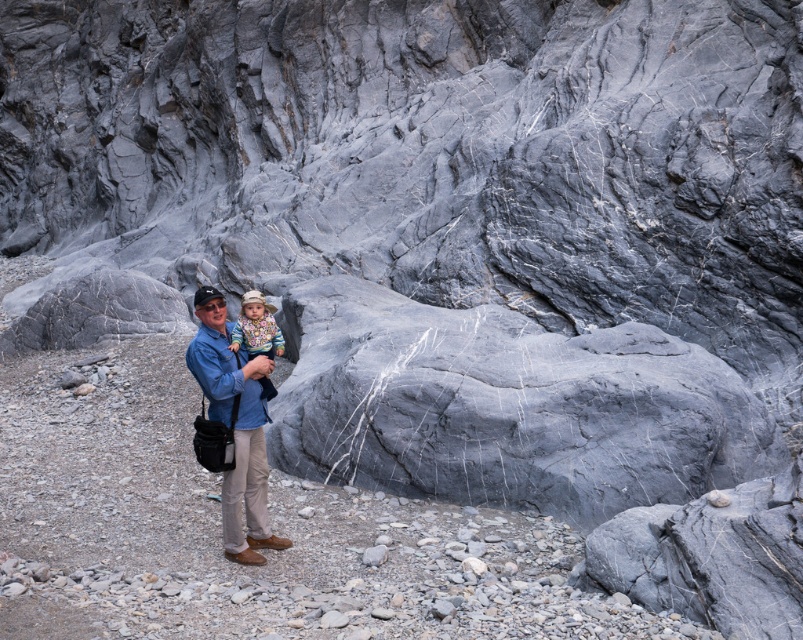
Is matte blue shirt at center bigger than multicolored knitted sweater at center?

Correct, matte blue shirt at center is larger in size than multicolored knitted sweater at center.

Measure the distance from matte blue shirt at center to multicolored knitted sweater at center.

They are 17.58 inches apart.

The height and width of the screenshot is (640, 803). I want to click on matte blue shirt at center, so click(x=235, y=426).

Image resolution: width=803 pixels, height=640 pixels. I want to click on matte blue shirt at center, so click(x=235, y=426).